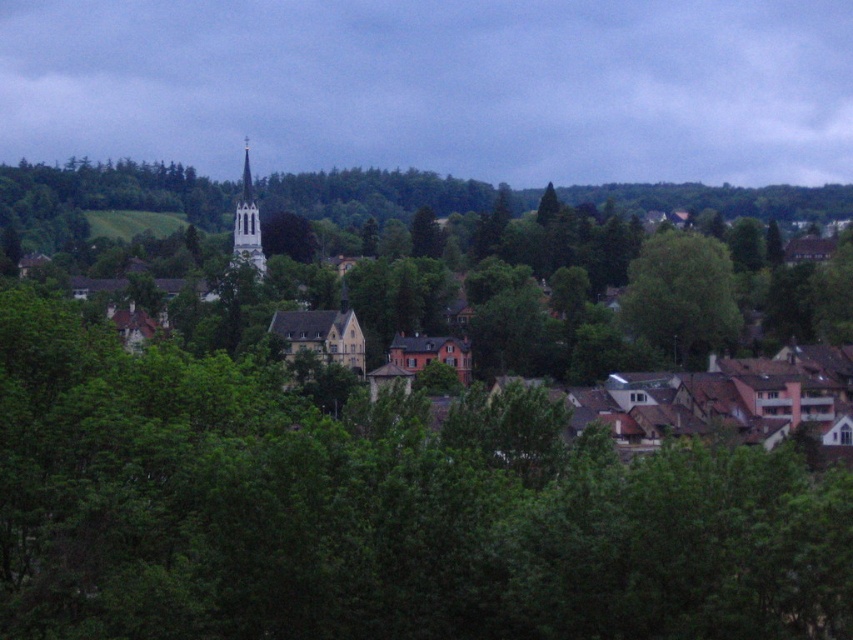
Question: Can you confirm if green leafy tree at center is smaller than smooth white steeple at center?

Choices:
 (A) no
 (B) yes

Answer: (B)

Question: Which point is farther to the camera?

Choices:
 (A) (730, 292)
 (B) (236, 253)

Answer: (B)

Question: Among these points, which one is nearest to the camera?

Choices:
 (A) (251, 204)
 (B) (703, 352)

Answer: (B)

Question: Can you confirm if green leafy tree at center is positioned above smooth white steeple at center?

Choices:
 (A) no
 (B) yes

Answer: (A)

Question: Does green leafy tree at center appear on the left side of smooth white steeple at center?

Choices:
 (A) yes
 (B) no

Answer: (B)